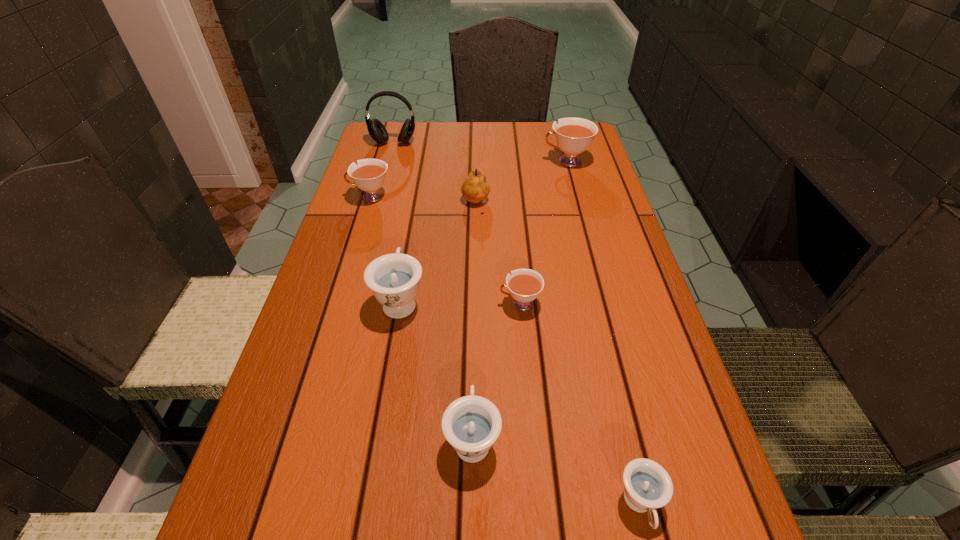
Select which blue teacup appears as the third closest to the second farthest white teacup. Please provide its 2D coordinates. Your answer should be formatted as a tuple, i.e. [(x, y)], where the tuple contains the x and y coordinates of a point satisfying the conditions above.

[(647, 485)]

Locate an element on the screen. The image size is (960, 540). blue teacup that stands as the closest to the pear is located at coordinates (394, 278).

Find the location of a particular element. This screenshot has width=960, height=540. free location that satisfies the following two spatial constraints: 1. on the side of the pear with the handle; 2. on the right side of the fifth teacup from right to left is located at coordinates (417, 204).

Locate an element on the screen. The width and height of the screenshot is (960, 540). free location that satisfies the following two spatial constraints: 1. on the side of the pear with the handle; 2. on the left side of the third teacup from left to right is located at coordinates (475, 204).

The height and width of the screenshot is (540, 960). I want to click on free space that satisfies the following two spatial constraints: 1. on the side of the second blue teacup from right to left with the handle; 2. on the left side of the pear, so click(x=475, y=204).

The width and height of the screenshot is (960, 540). Identify the location of free space that satisfies the following two spatial constraints: 1. on the side of the farthest blue teacup with the handle; 2. on the left side of the pear. (417, 204).

Where is `free space that satisfies the following two spatial constraints: 1. on the side of the farthest blue teacup with the handle; 2. on the side of the second biggest white teacup with the handle`? This screenshot has width=960, height=540. free space that satisfies the following two spatial constraints: 1. on the side of the farthest blue teacup with the handle; 2. on the side of the second biggest white teacup with the handle is located at coordinates (419, 197).

Find the location of a particular element. Image resolution: width=960 pixels, height=540 pixels. free location that satisfies the following two spatial constraints: 1. on the ear cups of the headset; 2. on the side of the second biggest white teacup with the handle is located at coordinates (378, 197).

Locate an element on the screen. This screenshot has width=960, height=540. free space that satisfies the following two spatial constraints: 1. on the side of the rightmost white teacup with the handle; 2. on the side of the rightmost blue teacup with the handle is located at coordinates (660, 505).